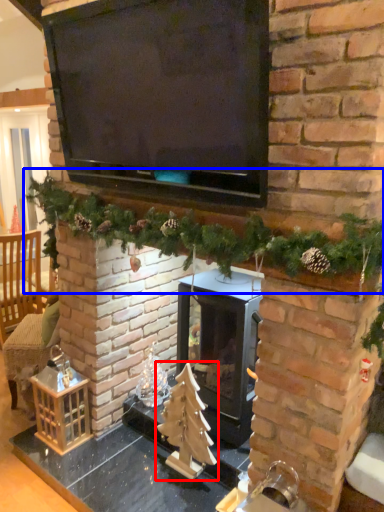
Question: Which object appears closest to the camera in this image, christmas tree (highlighted by a red box) or christmas decoration (highlighted by a blue box)?

Choices:
 (A) christmas tree
 (B) christmas decoration

Answer: (B)